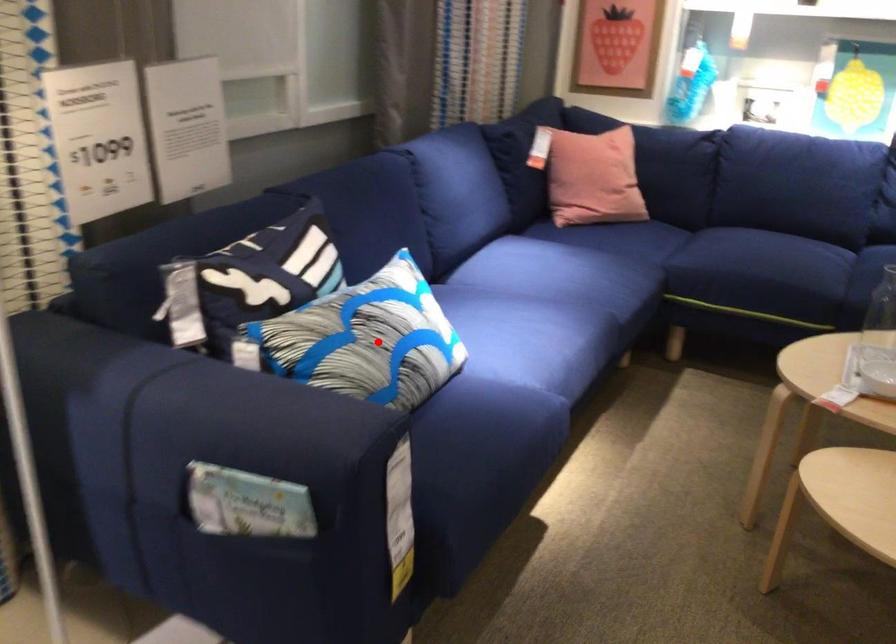
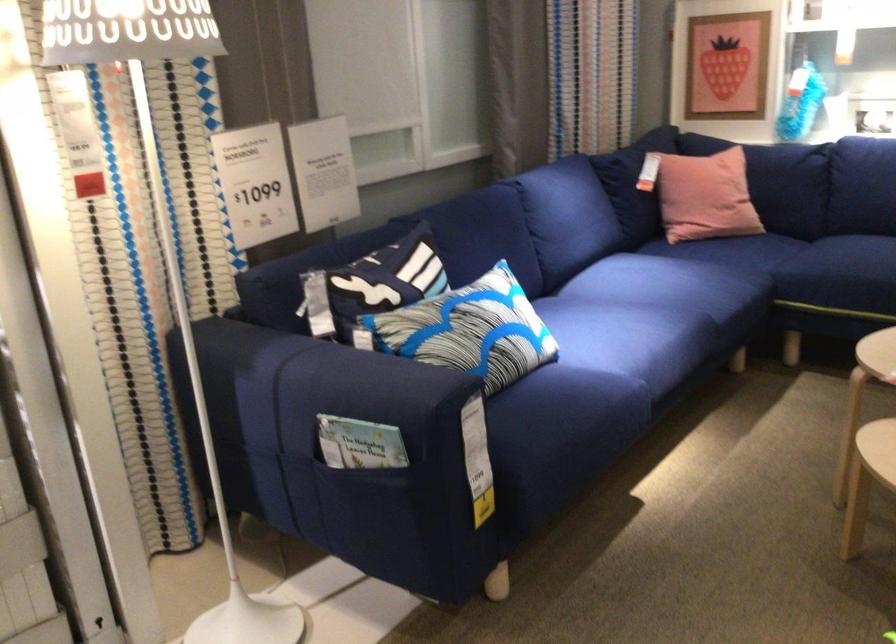
Question: I am providing you with two images of the same scene from different viewpoints. A red point is shown in image1. For the corresponding object point in image2, is it positioned nearer or farther from the camera?

Choices:
 (A) Nearer
 (B) Farther

Answer: (B)